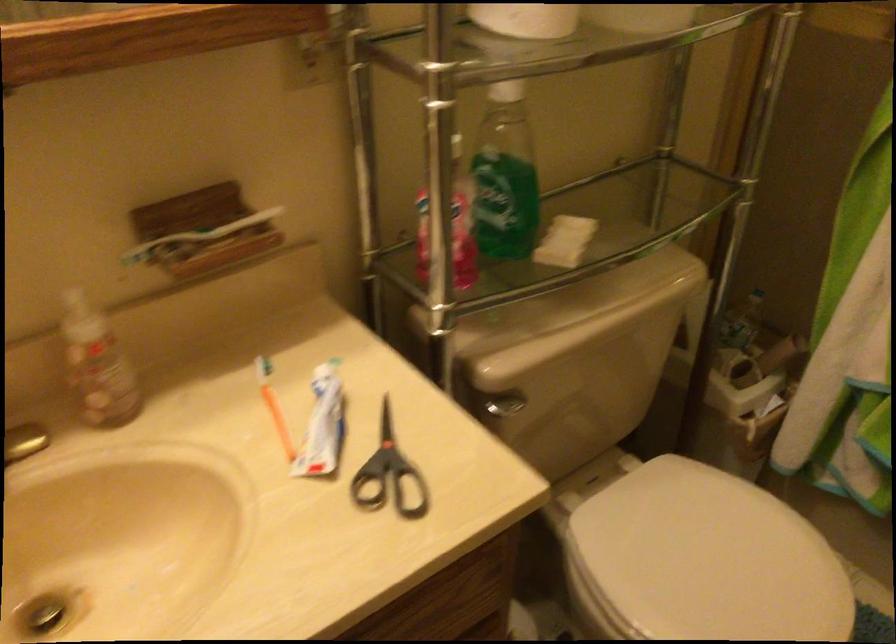
Locate an element on the screen. white toothbrush is located at coordinates (212, 230).